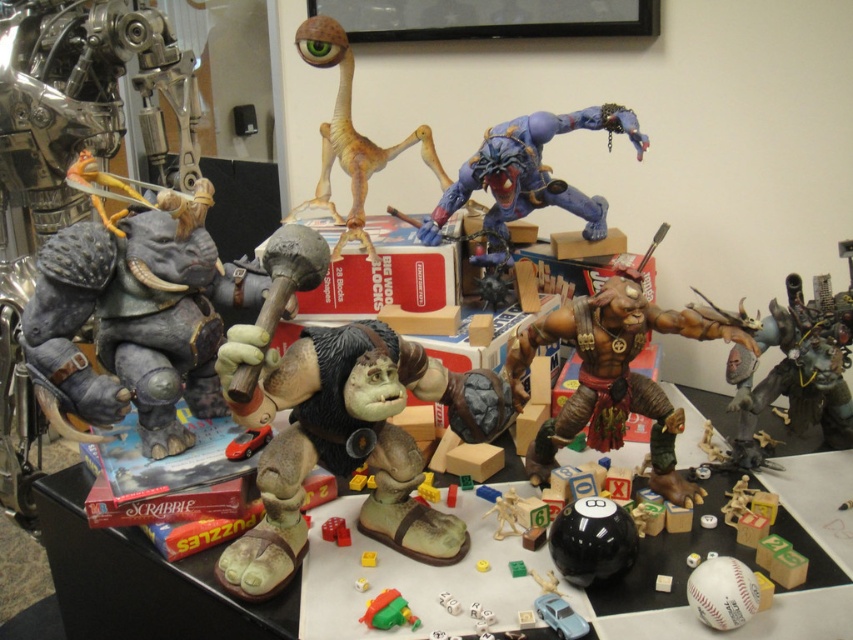
Is rubberized green and red toy at center above matte brown dice at center?

Actually, rubberized green and red toy at center is below matte brown dice at center.

Does rubberized green and red toy at center appear on the left side of matte brown dice at center?

In fact, rubberized green and red toy at center is to the right of matte brown dice at center.

Who is more forward, (390, 620) or (338, 534)?

Positioned in front is point (390, 620).

I want to click on rubberized green and red toy at center, so [387, 611].

How much distance is there between blue matte figure at upper right and light blue plastic toy car at center?

blue matte figure at upper right and light blue plastic toy car at center are 31.15 inches apart from each other.

Does blue matte figure at upper right come behind light blue plastic toy car at center?

Yes, blue matte figure at upper right is behind light blue plastic toy car at center.

Who is more distant from viewer, (515, 129) or (550, 618)?

Point (515, 129)

Find the location of a particular element. blue matte figure at upper right is located at coordinates (527, 176).

Describe the element at coordinates (612, 376) in the screenshot. Image resolution: width=853 pixels, height=640 pixels. I see `brown leather figurine at center` at that location.

Can you confirm if brown leather figurine at center is positioned below rubberized green and red toy at center?

Incorrect, brown leather figurine at center is not positioned below rubberized green and red toy at center.

Which is behind, point (642, 300) or point (386, 614)?

Point (642, 300)

This screenshot has height=640, width=853. I want to click on brown leather figurine at center, so click(612, 376).